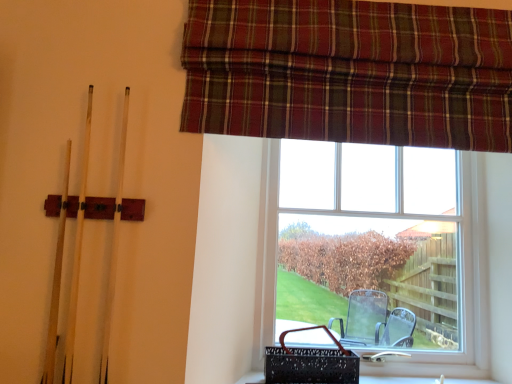
Question: Does clear glass window at center appear on the left side of plaid fabric curtain at upper right?

Choices:
 (A) yes
 (B) no

Answer: (B)

Question: Does clear glass window at center come in front of plaid fabric curtain at upper right?

Choices:
 (A) no
 (B) yes

Answer: (A)

Question: Is clear glass window at center next to plaid fabric curtain at upper right?

Choices:
 (A) yes
 (B) no

Answer: (B)

Question: From a real-world perspective, is clear glass window at center over plaid fabric curtain at upper right?

Choices:
 (A) yes
 (B) no

Answer: (B)

Question: Considering the relative sizes of clear glass window at center and plaid fabric curtain at upper right in the image provided, is clear glass window at center smaller than plaid fabric curtain at upper right?

Choices:
 (A) no
 (B) yes

Answer: (A)

Question: Does clear glass window at center have a greater width compared to plaid fabric curtain at upper right?

Choices:
 (A) no
 (B) yes

Answer: (B)

Question: Is plaid fabric curtain at upper right at the left side of clear glass window at center?

Choices:
 (A) yes
 (B) no

Answer: (A)

Question: Considering the relative sizes of plaid fabric curtain at upper right and clear glass window at center in the image provided, is plaid fabric curtain at upper right taller than clear glass window at center?

Choices:
 (A) no
 (B) yes

Answer: (A)

Question: Does plaid fabric curtain at upper right have a smaller size compared to clear glass window at center?

Choices:
 (A) yes
 (B) no

Answer: (A)

Question: Is plaid fabric curtain at upper right surrounding clear glass window at center?

Choices:
 (A) yes
 (B) no

Answer: (B)

Question: Considering the relative positions of plaid fabric curtain at upper right and clear glass window at center in the image provided, is plaid fabric curtain at upper right to the right of clear glass window at center from the viewer's perspective?

Choices:
 (A) yes
 (B) no

Answer: (B)

Question: Does plaid fabric curtain at upper right come behind clear glass window at center?

Choices:
 (A) no
 (B) yes

Answer: (A)

Question: Relative to clear glass window at center, is plaid fabric curtain at upper right in front or behind?

Choices:
 (A) front
 (B) behind

Answer: (A)